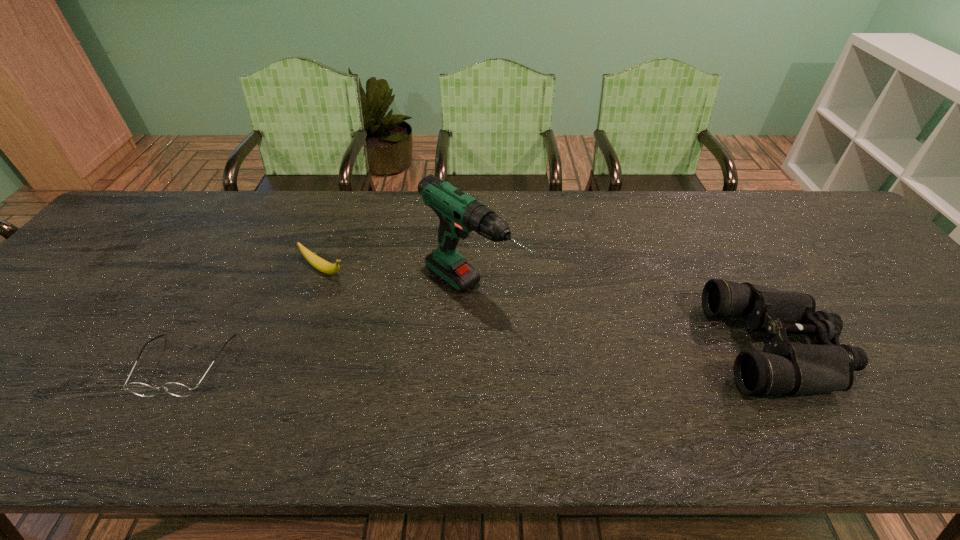
The height and width of the screenshot is (540, 960). In the image, there is a desktop. Find the location of `vacant area at the far right corner`. vacant area at the far right corner is located at coordinates (789, 207).

Find the location of a particular element. free space between the tallest object and the leftmost object is located at coordinates pyautogui.click(x=328, y=328).

Where is `blank region between the rightmost object and the drill`? blank region between the rightmost object and the drill is located at coordinates (625, 319).

This screenshot has width=960, height=540. In order to click on vacant area that lies between the tallest object and the binoculars in this screenshot , I will do `click(625, 319)`.

Where is `vacant space that is in between the third object from left to right and the binoculars`? This screenshot has height=540, width=960. vacant space that is in between the third object from left to right and the binoculars is located at coordinates (625, 319).

Find the location of a particular element. Image resolution: width=960 pixels, height=540 pixels. free space between the tallest object and the rightmost object is located at coordinates (x=625, y=319).

Where is `empty location between the binoculars and the tallest object`? The width and height of the screenshot is (960, 540). empty location between the binoculars and the tallest object is located at coordinates (625, 319).

Identify the location of free space between the spectacles and the banana. The height and width of the screenshot is (540, 960). tap(254, 318).

This screenshot has width=960, height=540. Find the location of `vacant point located between the leftmost object and the banana`. vacant point located between the leftmost object and the banana is located at coordinates (254, 318).

The width and height of the screenshot is (960, 540). I want to click on free spot between the shortest object and the second object from right to left, so click(x=328, y=328).